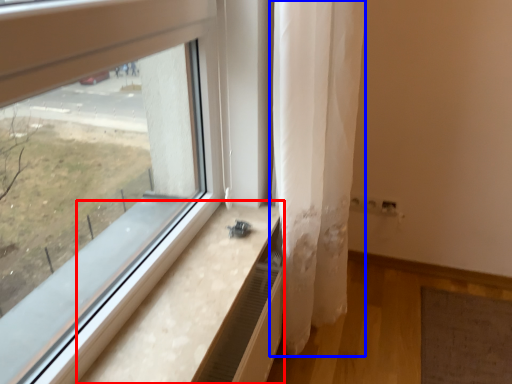
Question: Which object appears farthest to the camera in this image, window sill (highlighted by a red box) or curtain (highlighted by a blue box)?

Choices:
 (A) window sill
 (B) curtain

Answer: (B)